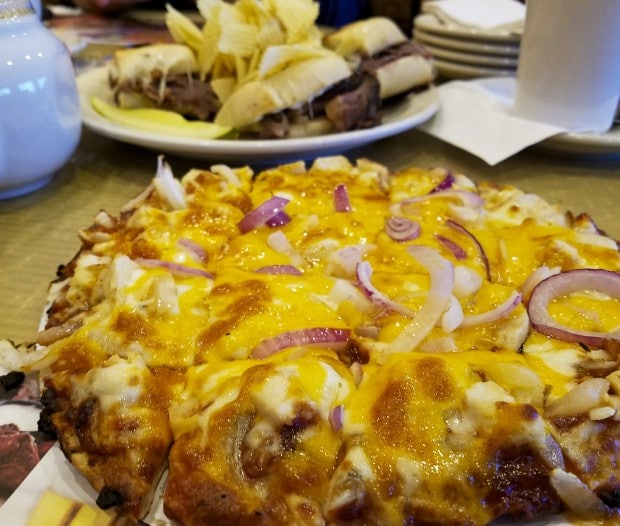
At what (x,y) coordinates should I click in order to perform the action: click on dish. Please return your answer as a coordinate pair (x, y). This screenshot has width=620, height=526. Looking at the image, I should click on pyautogui.click(x=475, y=37), pyautogui.click(x=475, y=45), pyautogui.click(x=475, y=60), pyautogui.click(x=475, y=67), pyautogui.click(x=580, y=131), pyautogui.click(x=234, y=140), pyautogui.click(x=31, y=128).